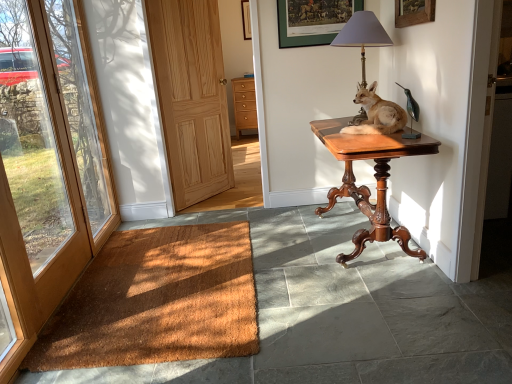
The height and width of the screenshot is (384, 512). Describe the element at coordinates (191, 97) in the screenshot. I see `light brown wood door at center, the 2th door when ordered from left to right` at that location.

Describe the element at coordinates (157, 301) in the screenshot. I see `brown coir doormat at lower left` at that location.

Locate an element on the screen. mahogany wood table at center is located at coordinates (374, 176).

At what (x,y) coordinates should I click in order to perform the action: click on light brown wood door at center, the 2th door when ordered from left to right. Please return your answer as a coordinate pair (x, y). The height and width of the screenshot is (384, 512). Looking at the image, I should click on (191, 97).

Can you confirm if brown coir doormat at lower left is shorter than wooden picture frame at upper center, acting as the 1th picture frame starting from the back?

Yes, brown coir doormat at lower left is shorter than wooden picture frame at upper center, acting as the 1th picture frame starting from the back.

In the scene shown: Can you confirm if brown coir doormat at lower left is bigger than wooden picture frame at upper center, placed as the 2th picture frame when sorted from bottom to top?

Indeed, brown coir doormat at lower left has a larger size compared to wooden picture frame at upper center, placed as the 2th picture frame when sorted from bottom to top.

From the picture: Between brown coir doormat at lower left and wooden picture frame at upper center, acting as the 1th picture frame starting from the back, which one is positioned in front?

brown coir doormat at lower left is in front.

Are brown coir doormat at lower left and wooden picture frame at upper center, which appears as the 1th picture frame when viewed from the left, beside each other?

There is a gap between brown coir doormat at lower left and wooden picture frame at upper center, which appears as the 1th picture frame when viewed from the left.

Which is in front, light wood/dark finish cabinet at center or light brown wood door at center, the 1th door in the back-to-front sequence?

light brown wood door at center, the 1th door in the back-to-front sequence, is in front.

Visually, is light wood/dark finish cabinet at center positioned to the left or to the right of light brown wood door at center, the 2th door positioned from the front?

In the image, light wood/dark finish cabinet at center appears on the right side of light brown wood door at center, the 2th door positioned from the front.

Based on their sizes in the image, would you say light wood/dark finish cabinet at center is bigger or smaller than light brown wood door at center, the 2th door positioned from the front?

Considering their sizes, light wood/dark finish cabinet at center takes up less space than light brown wood door at center, the 2th door positioned from the front.

Which is farther from the camera, (237, 98) or (187, 108)?

The point (237, 98) is farther.

Would you say mahogany wood table at center is outside green matte picture frame at upper center, the 2th picture frame in the left-to-right sequence?

mahogany wood table at center lies outside green matte picture frame at upper center, the 2th picture frame in the left-to-right sequence,'s area.

Measure the distance from mahogany wood table at center to green matte picture frame at upper center, the first picture frame from the right.

1.20 meters.

Is mahogany wood table at center closer to the viewer compared to green matte picture frame at upper center, which ranks as the second picture frame in top-to-bottom order?

Yes, mahogany wood table at center is closer to the viewer.

In terms of height, does light brown fur at center look taller or shorter compared to light wood/dark finish cabinet at center?

light brown fur at center is shorter than light wood/dark finish cabinet at center.

Is light brown fur at center further to camera compared to light wood/dark finish cabinet at center?

No, light brown fur at center is closer to the camera.

Is light brown fur at center facing towards light wood/dark finish cabinet at center?

No, light brown fur at center is not oriented towards light wood/dark finish cabinet at center.

From the image's perspective, is light brown fur at center beneath light wood/dark finish cabinet at center?

Yes, from the image's perspective, light brown fur at center is beneath light wood/dark finish cabinet at center.

From a real-world perspective, is matte gray lampshade at upper right above or below brown coir doormat at lower left?

Clearly, from a real-world perspective, matte gray lampshade at upper right is above brown coir doormat at lower left.

Who is bigger, matte gray lampshade at upper right or brown coir doormat at lower left?

Bigger between the two is matte gray lampshade at upper right.

Is point (191, 341) behind point (174, 137)?

No, it is in front of (174, 137).

Between brown coir doormat at lower left and light brown wood door at center, the 2th door positioned from the front, which one is positioned in front?

brown coir doormat at lower left is in front.

Can you confirm if brown coir doormat at lower left is smaller than light brown wood door at center, the 2th door when ordered from left to right?

Indeed, brown coir doormat at lower left has a smaller size compared to light brown wood door at center, the 2th door when ordered from left to right.

Who is shorter, brown coir doormat at lower left or light brown wood door at center, the 1th door in the back-to-front sequence?

brown coir doormat at lower left.

Considering the sizes of objects light wood/dark finish cabinet at center and matte gray lampshade at upper right in the image provided, who is bigger, light wood/dark finish cabinet at center or matte gray lampshade at upper right?

Bigger between the two is light wood/dark finish cabinet at center.

Which of these two, light wood/dark finish cabinet at center or matte gray lampshade at upper right, is wider?

light wood/dark finish cabinet at center is wider.

Who is taller, light wood/dark finish cabinet at center or matte gray lampshade at upper right?

light wood/dark finish cabinet at center is taller.

From a real-world perspective, starting from the brown coir doormat at lower left, which picture frame is the 2nd one vertically above it? Please provide its 2D coordinates.

[(246, 19)]

From the image's perspective, which door is the 1st one below the light wood/dark finish cabinet at center? Please provide its 2D coordinates.

[(191, 97)]

From the picture: Based on their spatial positions, is brown coir doormat at lower left or light wood/dark finish cabinet at center closer to wooden picture frame at upper center, which appears as the 1th picture frame when viewed from the left?

light wood/dark finish cabinet at center.

Looking at the image, which one is located further to brown coir doormat at lower left, light wood/dark finish cabinet at center or green matte picture frame at upper center, the first picture frame from the right?

light wood/dark finish cabinet at center.

Looking at the image, which one is located closer to light wood/dark finish cabinet at center, brown coir doormat at lower left or light brown wood door at center, the 2th door positioned from the front?

light brown wood door at center, the 2th door positioned from the front, lies closer to light wood/dark finish cabinet at center than the other object.

From the image, which object appears to be farther from light brown wood door at center, the 2th door when ordered from left to right, wooden picture frame at upper center, acting as the 2th picture frame starting from the right, or light wood/dark finish cabinet at center?

Based on the image, light wood/dark finish cabinet at center appears to be further to light brown wood door at center, the 2th door when ordered from left to right.

Considering their positions, is matte gray lampshade at upper right positioned further to mahogany wood table at center than brown coir doormat at lower left?

Based on the image, brown coir doormat at lower left appears to be further to mahogany wood table at center.

Which object lies nearer to the anchor point wooden door at left, which is the second door in right-to-left order, brown coir doormat at lower left or green matte picture frame at upper center, the 2th picture frame in the left-to-right sequence?

brown coir doormat at lower left.

From the image, which object appears to be farther from wooden door at left, which is the second door in right-to-left order, light brown fur at center or wooden picture frame at upper center, acting as the 1th picture frame starting from the back?

wooden picture frame at upper center, acting as the 1th picture frame starting from the back, lies further to wooden door at left, which is the second door in right-to-left order, than the other object.

Considering their positions, is matte gray lampshade at upper right positioned closer to light brown wood door at center, the 2th door when ordered from left to right, than wooden picture frame at upper center, placed as the 2th picture frame when sorted from bottom to top?

The object closer to light brown wood door at center, the 2th door when ordered from left to right, is wooden picture frame at upper center, placed as the 2th picture frame when sorted from bottom to top.

Locate an element on the screen. This screenshot has width=512, height=384. door located between green matte picture frame at upper center, acting as the first picture frame starting from the bottom, and wooden picture frame at upper center, acting as the 2th picture frame starting from the right, in the depth direction is located at coordinates (191, 97).

Find the location of a particular element. dog situated between wooden door at left, which is the second door in right-to-left order, and matte gray lampshade at upper right from left to right is located at coordinates (377, 114).

This screenshot has width=512, height=384. Find the location of `lamp positioned between light brown fur at center and green matte picture frame at upper center, the first picture frame viewed from the front, from near to far`. lamp positioned between light brown fur at center and green matte picture frame at upper center, the first picture frame viewed from the front, from near to far is located at coordinates (362, 36).

Locate an element on the screen. doormat between wooden door at left, which is the 2th door in back-to-front order, and matte gray lampshade at upper right, in the horizontal direction is located at coordinates (157, 301).